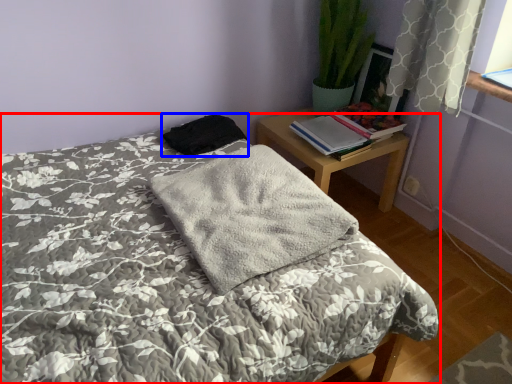
Question: Which object is further to the camera taking this photo, bed (highlighted by a red box) or material (highlighted by a blue box)?

Choices:
 (A) bed
 (B) material

Answer: (B)